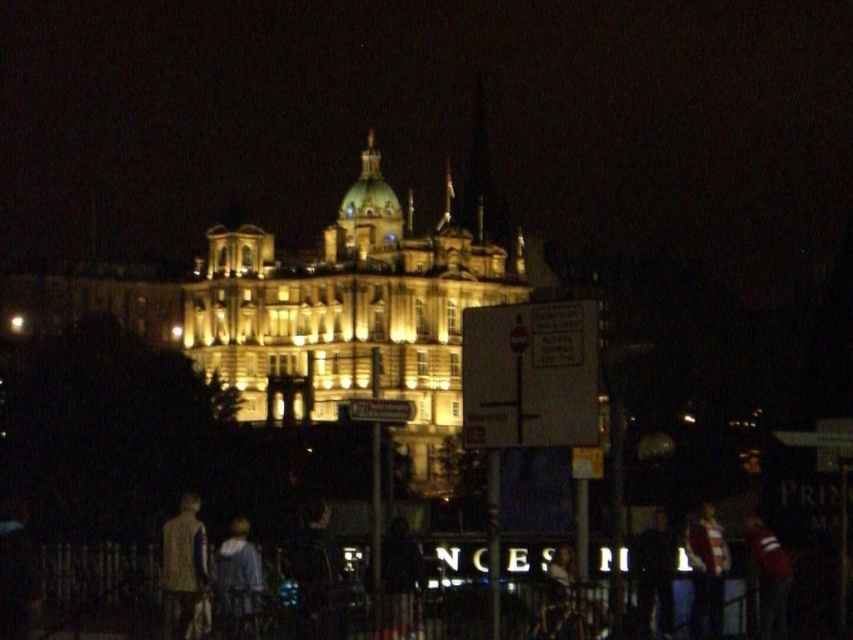
Question: Does dark blue jacket at lower center appear over light blue fabric shirt at center?

Choices:
 (A) no
 (B) yes

Answer: (A)

Question: Is light brown fabric jacket at lower left further to camera compared to dark blue jeans at lower right?

Choices:
 (A) yes
 (B) no

Answer: (B)

Question: Which of the following is the closest to the observer?

Choices:
 (A) (759, 566)
 (B) (672, 561)
 (C) (701, 573)
 (D) (320, 256)

Answer: (C)

Question: Which object is positioned farthest from the dark blue jeans at lower right?

Choices:
 (A) illuminated stone palace at center
 (B) dark blue jacket at lower center
 (C) light brown fabric jacket at lower left

Answer: (C)

Question: Based on their relative distances, which object is nearer to the dark blue jeans at lower right?

Choices:
 (A) light blue fabric shirt at center
 (B) illuminated stone palace at center

Answer: (A)

Question: Can you confirm if dark blue jeans at lower right is wider than dark blue jersey at lower right?

Choices:
 (A) no
 (B) yes

Answer: (B)